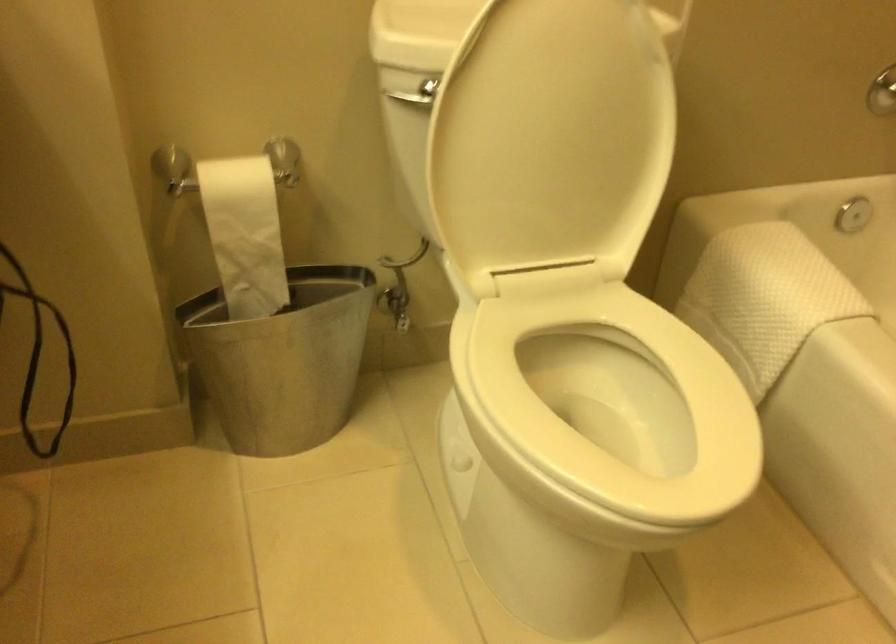
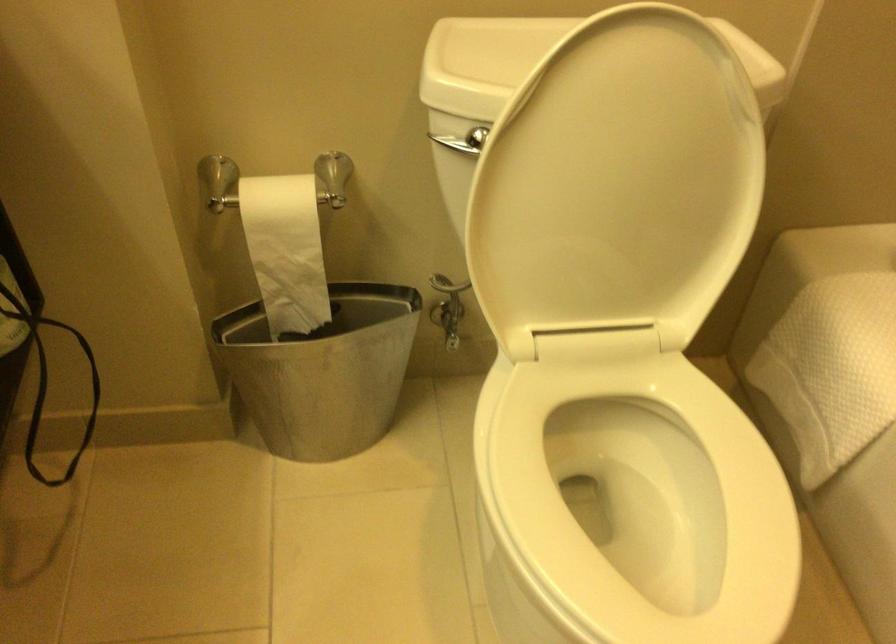
Find the pixel in the second image that matches pixel 554 122 in the first image.

(617, 183)